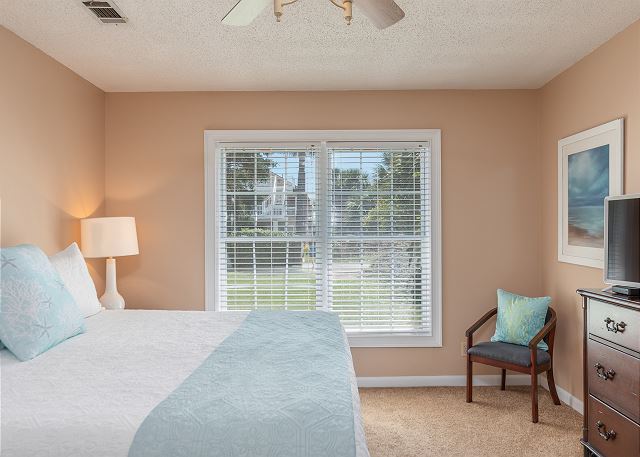
I want to click on lights, so click(x=342, y=8), click(x=246, y=20), click(x=269, y=20), click(x=109, y=245), click(x=108, y=285).